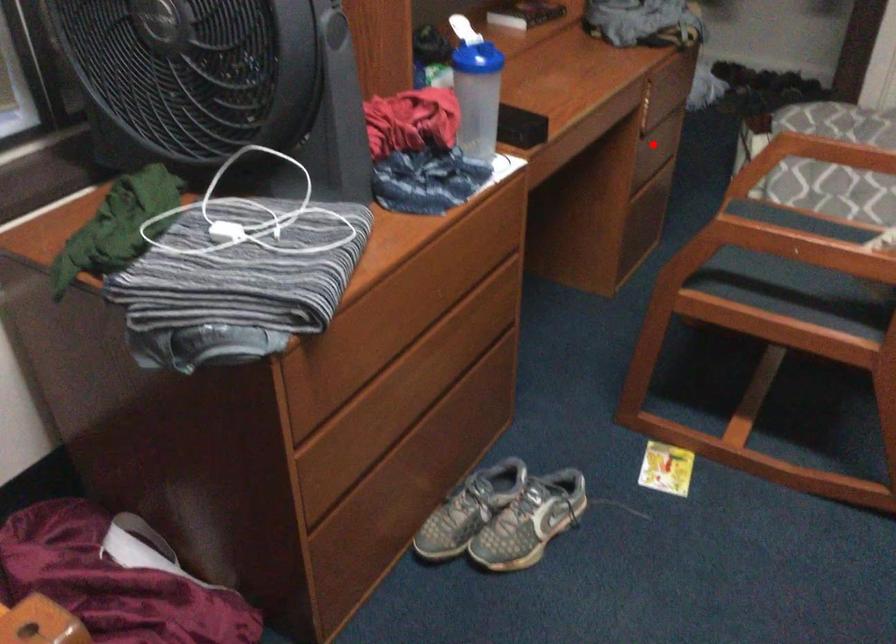
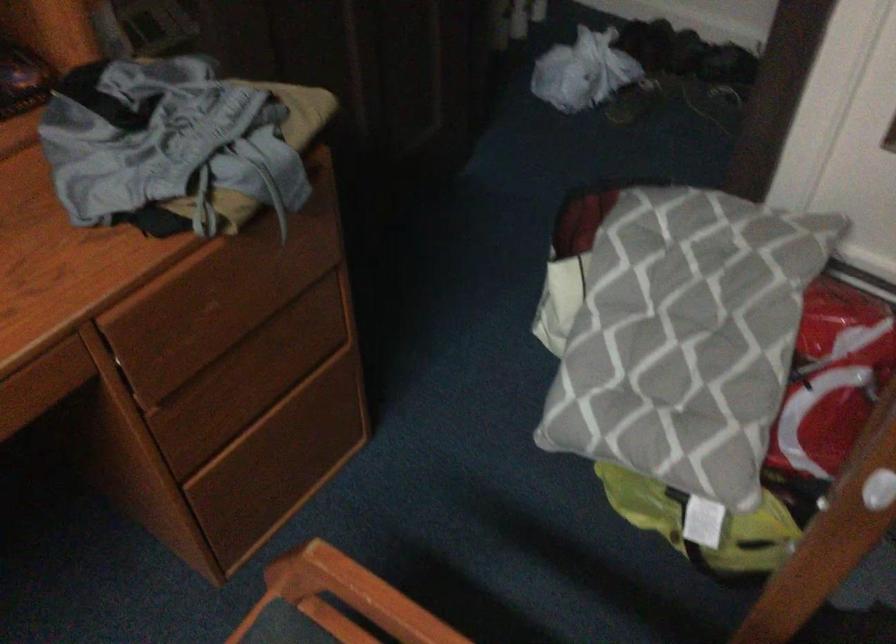
Question: I am providing you with two images of the same scene from different viewpoints. In image1, a red point is highlighted. Considering the same 3D point in image2, which of the following is correct?

Choices:
 (A) It is closer
 (B) It is farther

Answer: (A)